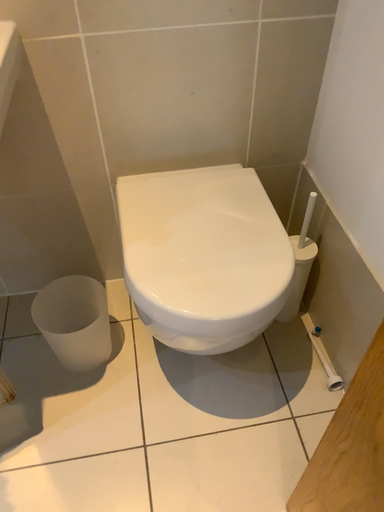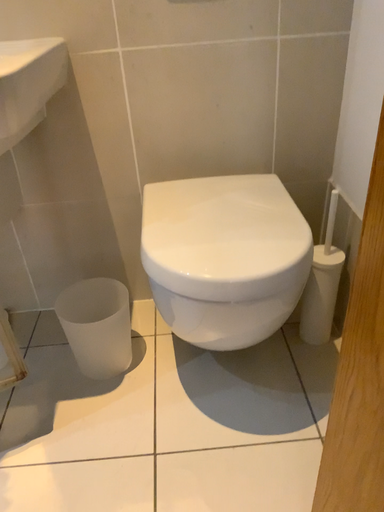
Question: How did the camera likely rotate when shooting the video?

Choices:
 (A) rotated downward
 (B) rotated upward

Answer: (B)